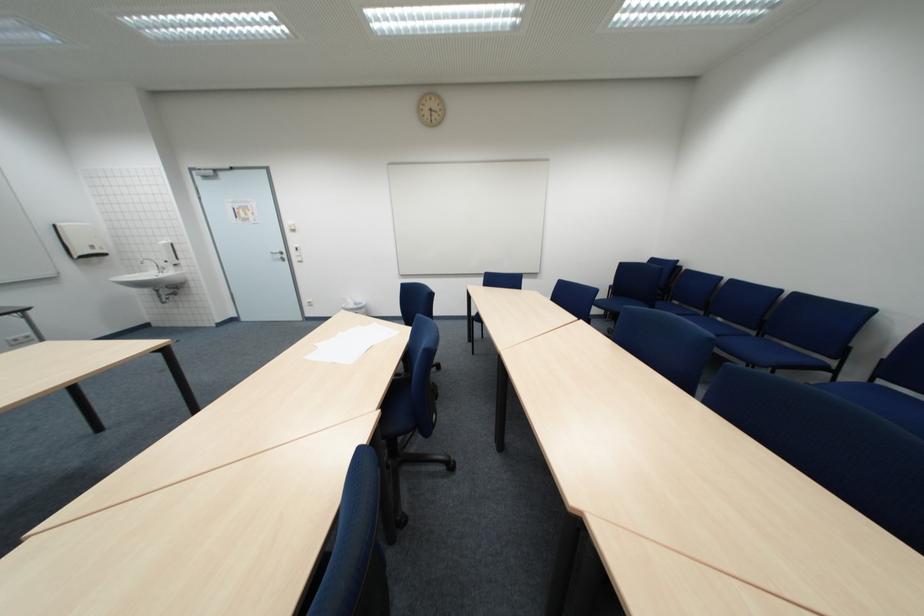
Where is `paper towel dispenser`? This screenshot has height=616, width=924. paper towel dispenser is located at coordinates (80, 240).